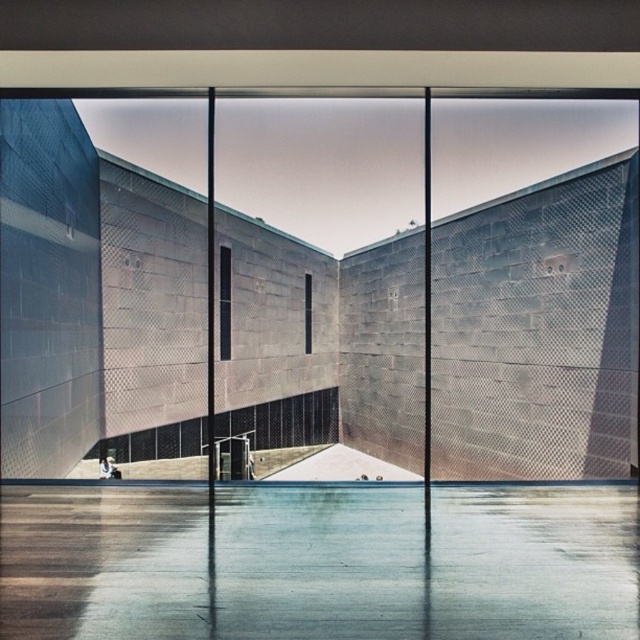
Question: Which object appears farthest from the camera in this image?

Choices:
 (A) transparent glass door at center
 (B) white matte skateboard at lower center

Answer: (B)

Question: Does transparent glass door at center have a lesser width compared to white matte skateboard at lower center?

Choices:
 (A) yes
 (B) no

Answer: (B)

Question: Which object appears closest to the camera in this image?

Choices:
 (A) transparent glass door at center
 (B) white matte skateboard at lower center

Answer: (A)

Question: Among these points, which one is farthest from the camera?

Choices:
 (A) (100, 458)
 (B) (544, 396)

Answer: (B)

Question: Can you confirm if transparent glass door at center is positioned to the right of white matte skateboard at lower center?

Choices:
 (A) yes
 (B) no

Answer: (A)

Question: Considering the relative positions of transparent glass door at center and white matte skateboard at lower center in the image provided, where is transparent glass door at center located with respect to white matte skateboard at lower center?

Choices:
 (A) below
 (B) above

Answer: (B)